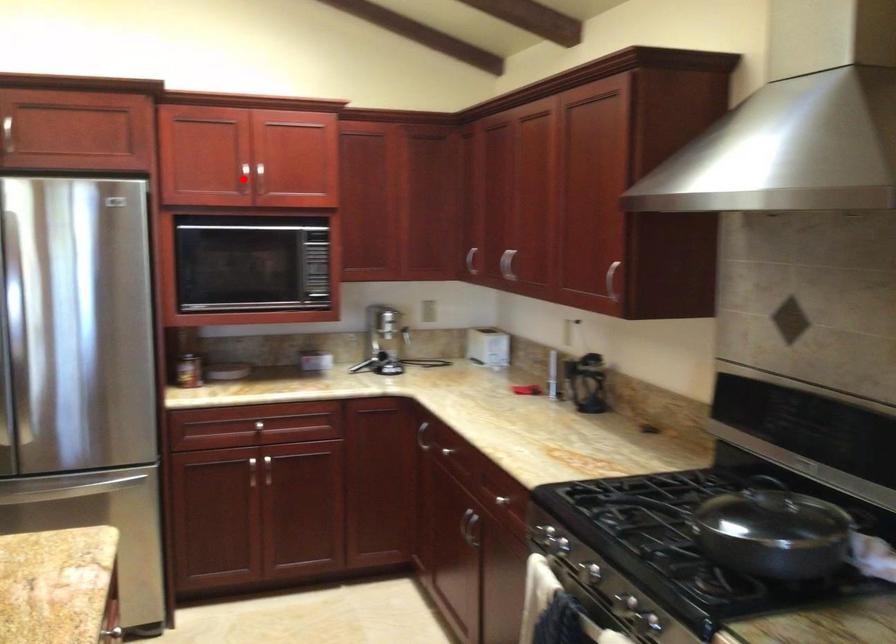
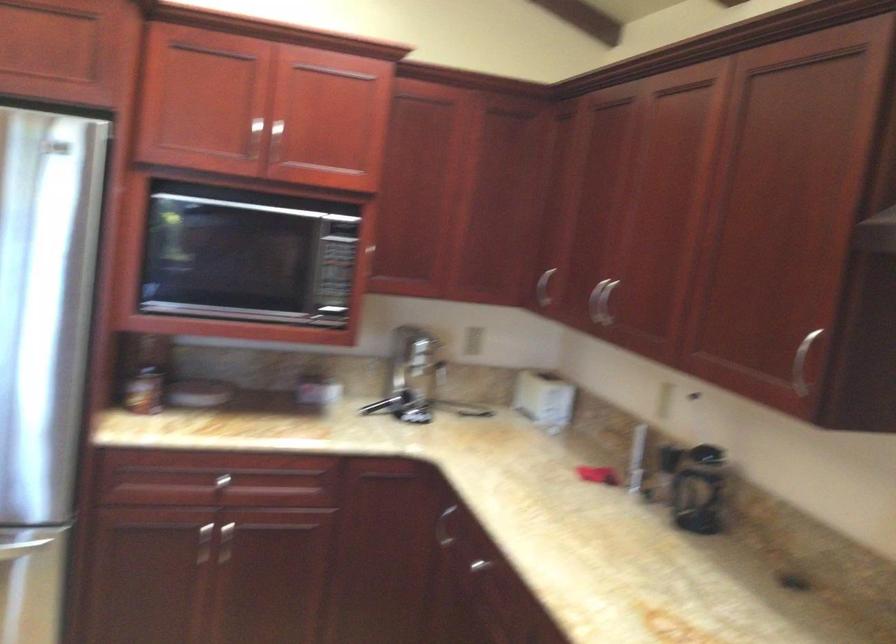
Locate, in the second image, the point that corresponds to the highlighted location in the first image.

(254, 138)